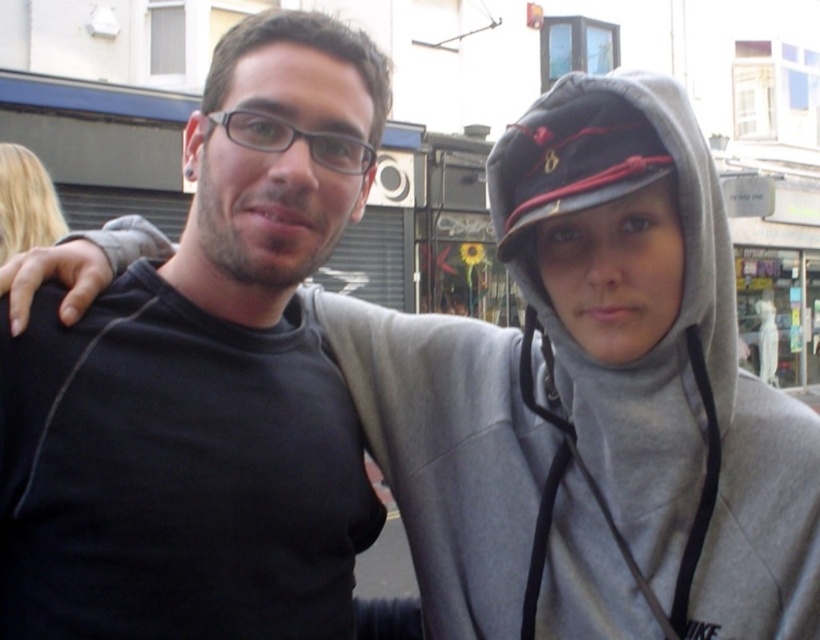
Question: From the image, what is the correct spatial relationship of matte black shirt at center in relation to gray fleece hoodie at center?

Choices:
 (A) below
 (B) above

Answer: (B)

Question: Is matte black shirt at center positioned at the back of gray fleece hoodie at center?

Choices:
 (A) no
 (B) yes

Answer: (B)

Question: Which point is closer to the camera taking this photo?

Choices:
 (A) (673, 324)
 (B) (51, 500)

Answer: (B)

Question: Is matte black shirt at center thinner than gray fleece hoodie at center?

Choices:
 (A) yes
 (B) no

Answer: (B)

Question: Which object appears closest to the camera in this image?

Choices:
 (A) gray fleece hoodie at center
 (B) matte black shirt at center

Answer: (A)